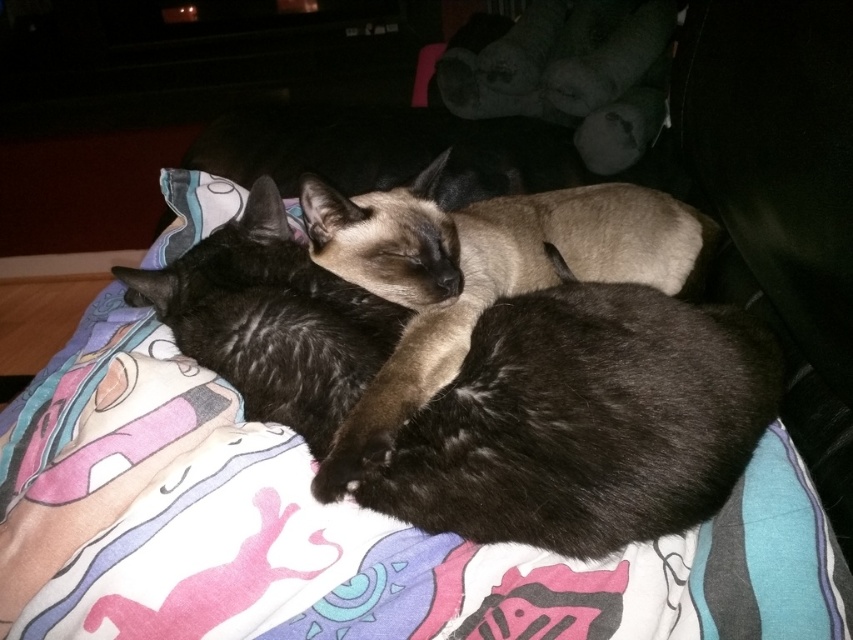
Who is positioned more to the right, printed fabric blanket at center or smokey brown fur at center?

smokey brown fur at center

Is point (93, 588) less distant than point (576, 244)?

Yes.

You are a GUI agent. You are given a task and a screenshot of the screen. Output one action in this format:
    pyautogui.click(x=<x>, y=<y>)
    Task: Click on the printed fabric blanket at center
    This screenshot has height=640, width=853.
    Given the screenshot: What is the action you would take?
    pyautogui.click(x=338, y=531)

This screenshot has height=640, width=853. I want to click on printed fabric blanket at center, so click(338, 531).